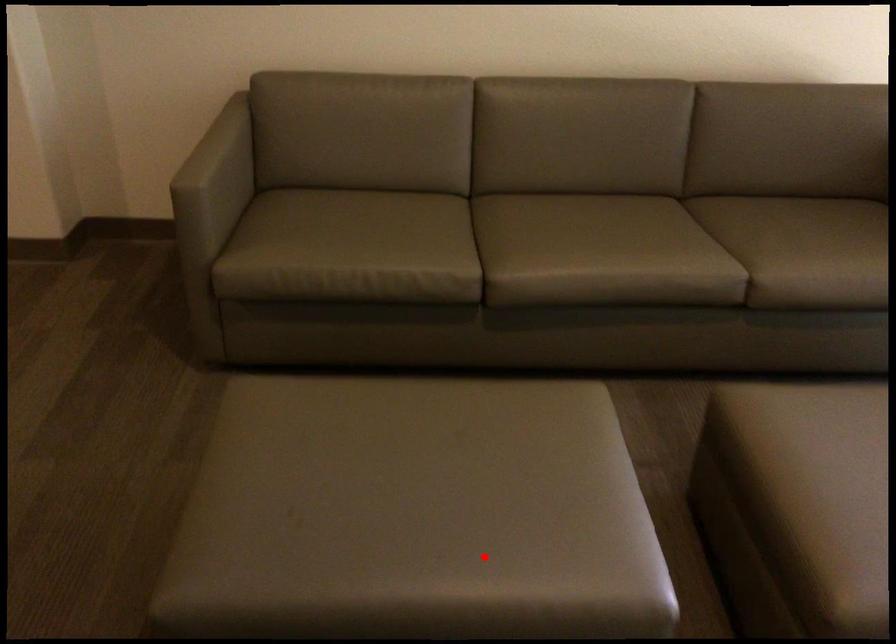
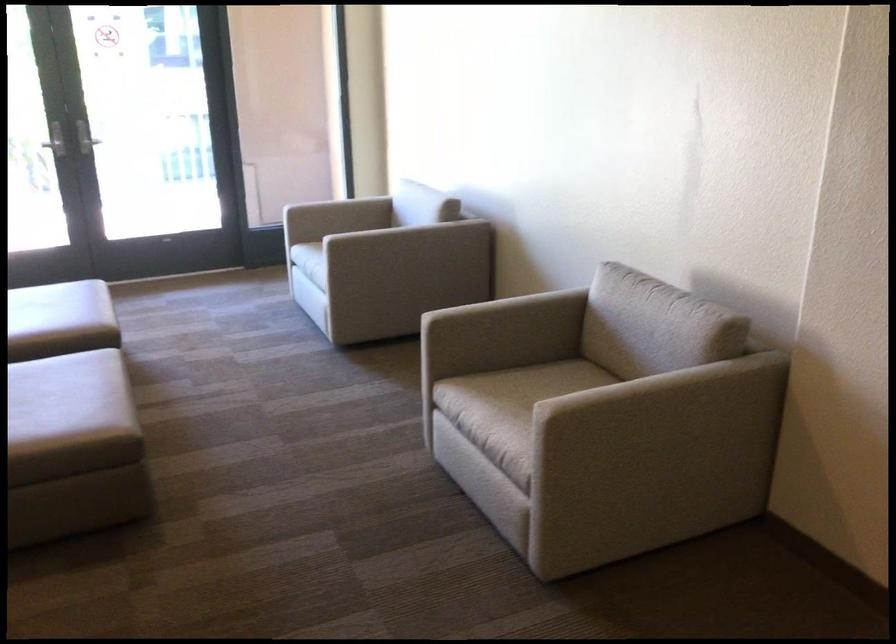
Question: A red point is marked in image1. In image2, is the corresponding 3D point closer to the camera or farther? Reply with the corresponding letter.

Choices:
 (A) The corresponding 3D point is closer.
 (B) The corresponding 3D point is farther.

Answer: (B)